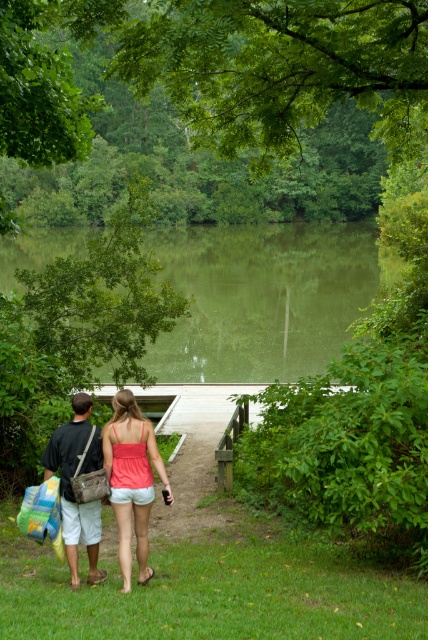
You are a photographer trying to capture a clear shot of the matte brown bag at center without the matte coral tank top at center blocking it. How should you adjust your position?

The matte coral tank top at center is positioned over the matte brown bag at center, so you should move your position to lower your angle to see below the matte coral tank top at center and capture the matte brown bag at center.

You are standing on the grassy area in front of the wooden dock. You want to take a photo of the green reflective water at center and the matte coral tank top at center. Which object should you focus on first to ensure both are in the frame?

You should focus on the matte coral tank top at center first because it is closer to you than the green reflective water at center, which is further away. This way, both will be in the frame as you adjust the camera.